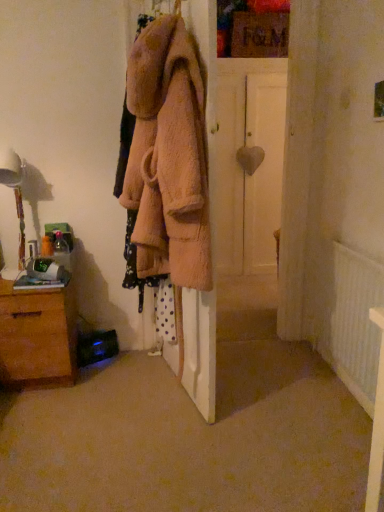
Locate an element on the screen. vacant space positioned to the left of white textured radiator at lower right is located at coordinates (277, 391).